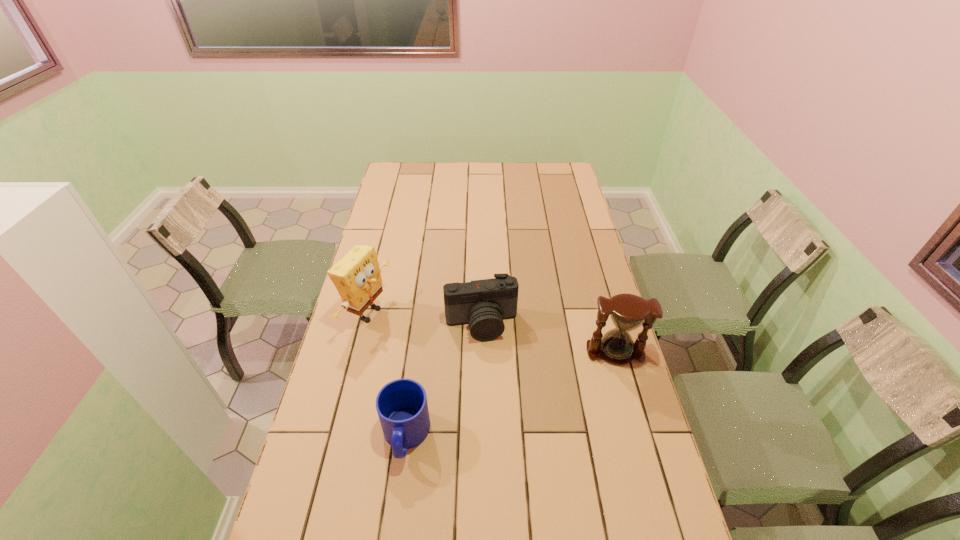
The image size is (960, 540). Find the location of `free space on the desktop that is between the nearest object and the rightmost object and is positioned at the lens of the second shortest object`. free space on the desktop that is between the nearest object and the rightmost object and is positioned at the lens of the second shortest object is located at coordinates (497, 399).

This screenshot has width=960, height=540. I want to click on vacant space on the desktop that is between the shortest object and the rightmost object and is positioned on the face of the leftmost object, so click(x=543, y=381).